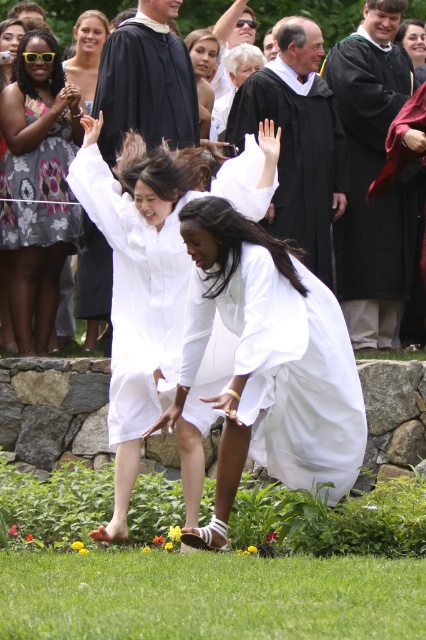
You are standing in the graduation ceremony scene and want to move from the point at coordinate point (63,132) to the point at coordinate point (322,224). Which direction should you move in to get closer to your destination?

To move from point (63,132) to point (322,224), you should move towards the upper right direction since point (63,132) is closer to the viewer than point (322,224), meaning it is physically behind in the scene.

What is located at the coordinate point (37,184) in the image?

The coordinate point (37,184) is where the floral patterned dress at lower left is located.